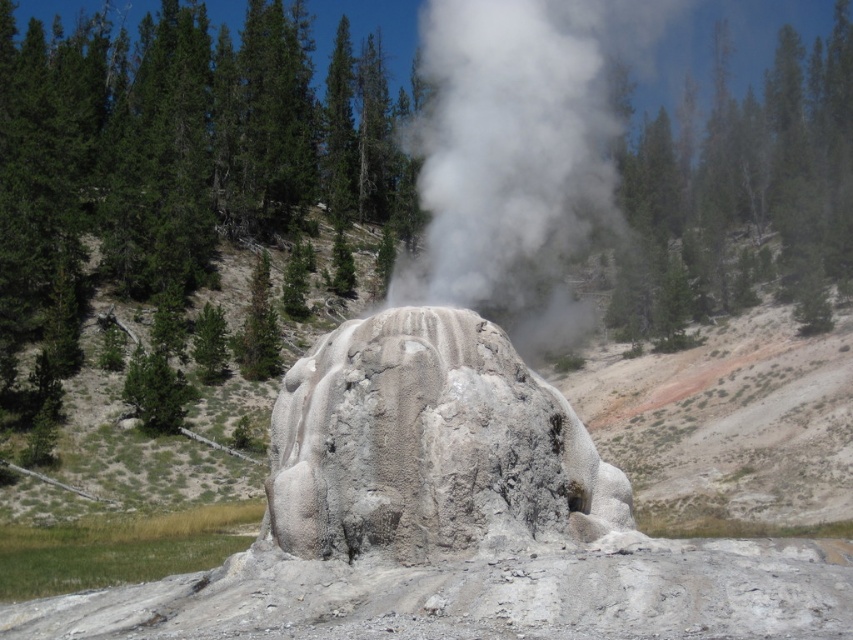
Based on the photo, does white textured rock at center have a lesser width compared to white vapor steam at center?

Yes, white textured rock at center is thinner than white vapor steam at center.

At what (x,y) coordinates should I click in order to perform the action: click on white textured rock at center. Please return your answer as a coordinate pair (x, y). Looking at the image, I should click on (428, 445).

Is white rock formation at center below white vapor steam at center?

Yes.

Who is positioned more to the right, white rock formation at center or white vapor steam at center?

white vapor steam at center is more to the right.

Does point (665, 500) lie in front of point (546, 320)?

Yes, point (665, 500) is closer to viewer.

The height and width of the screenshot is (640, 853). Find the location of `white rock formation at center`. white rock formation at center is located at coordinates (727, 422).

Between white rock formation at center and white textured rock at center, which one appears on the right side from the viewer's perspective?

From the viewer's perspective, white rock formation at center appears more on the right side.

Who is shorter, white rock formation at center or white textured rock at center?

With less height is white textured rock at center.

Is point (67, 422) closer to camera compared to point (381, 362)?

No.

The height and width of the screenshot is (640, 853). I want to click on white rock formation at center, so click(x=727, y=422).